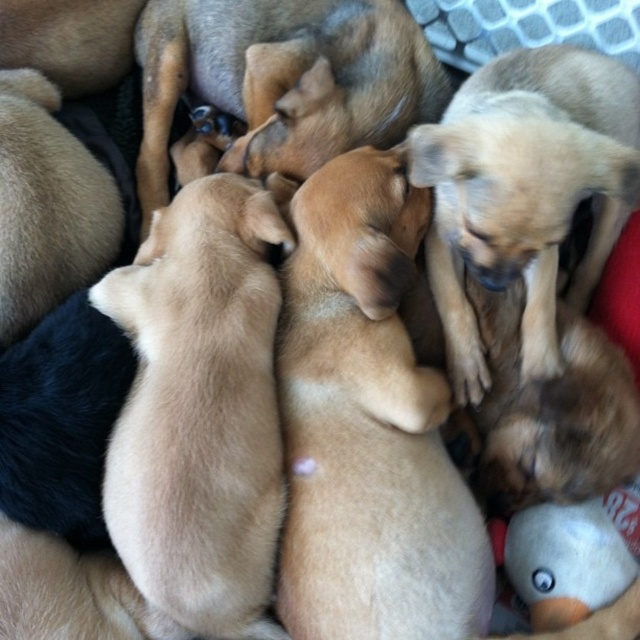
Can you confirm if light brown fur at upper right is thinner than light brown fur at center?

Indeed, light brown fur at upper right has a lesser width compared to light brown fur at center.

Does light brown fur at upper right appear on the right side of light brown fur at center?

Yes, light brown fur at upper right is to the right of light brown fur at center.

Identify the location of light brown fur at upper right. The height and width of the screenshot is (640, 640). (524, 192).